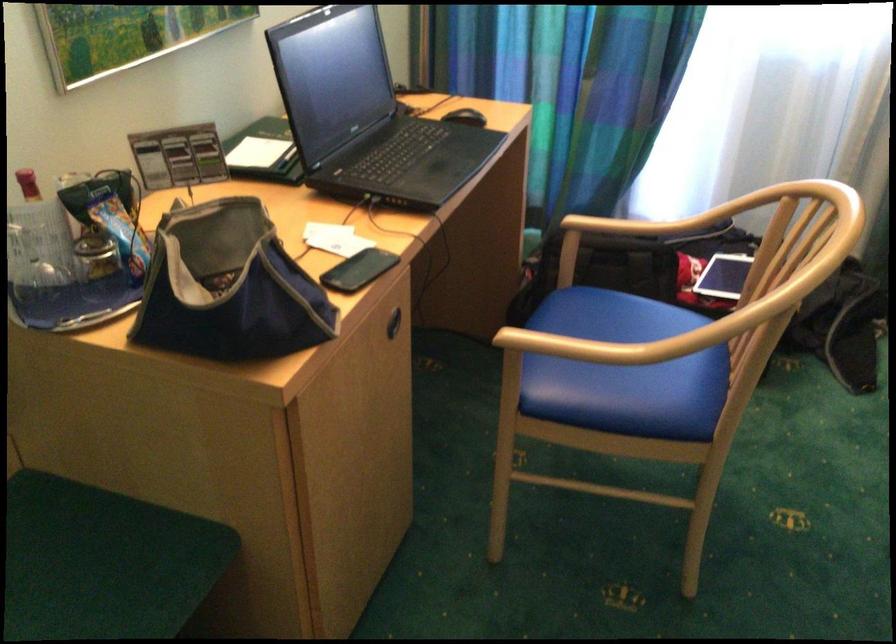
The height and width of the screenshot is (644, 896). What are the coordinates of `black computer mouse` in the screenshot? It's located at (464, 117).